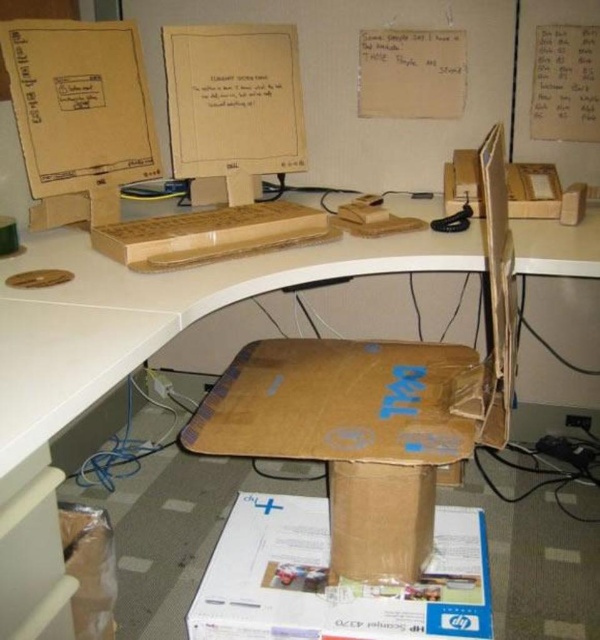
Question: Does brown cardboard computer desk at center have a larger size compared to white cardboard computer monitor at upper center?

Choices:
 (A) yes
 (B) no

Answer: (A)

Question: Does matte cardboard computer at upper center have a larger size compared to brown cardboard box at center?

Choices:
 (A) no
 (B) yes

Answer: (B)

Question: Is matte cardboard computer at upper center above brown cardboard box at center?

Choices:
 (A) no
 (B) yes

Answer: (B)

Question: Which object appears closest to the camera in this image?

Choices:
 (A) white cardboard computer monitor at upper center
 (B) matte cardboard computer at upper center
 (C) brown cardboard computer desk at center

Answer: (C)

Question: Which of the following is the farthest from the observer?

Choices:
 (A) matte cardboard computer at upper center
 (B) white paper at upper right

Answer: (B)

Question: Which point appears farthest from the camera in this image?

Choices:
 (A) (277, 33)
 (B) (206, 218)
 (C) (445, 576)

Answer: (A)